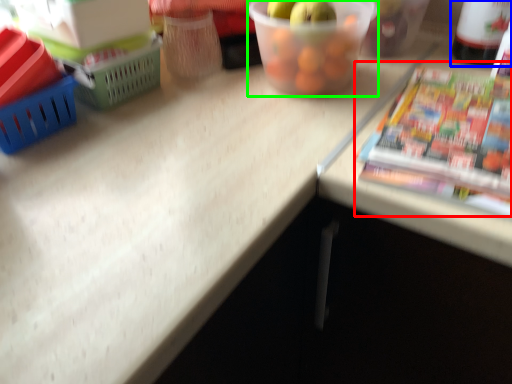
Question: Which object is positioned closest to paperback book (highlighted by a red box)? Select from bottle (highlighted by a blue box) and glass bowl (highlighted by a green box).

Choices:
 (A) bottle
 (B) glass bowl

Answer: (B)